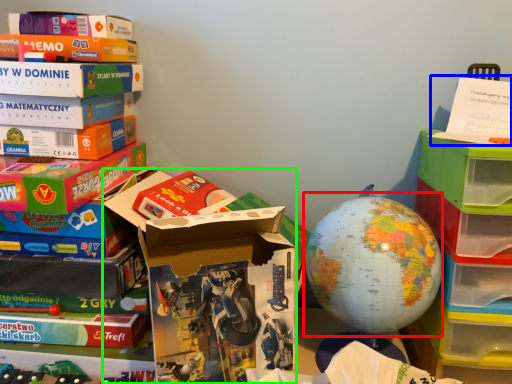
Question: Which is nearer to the earth (highlighted by a red box)? paperback book (highlighted by a blue box) or storage box (highlighted by a green box).

Choices:
 (A) paperback book
 (B) storage box

Answer: (B)